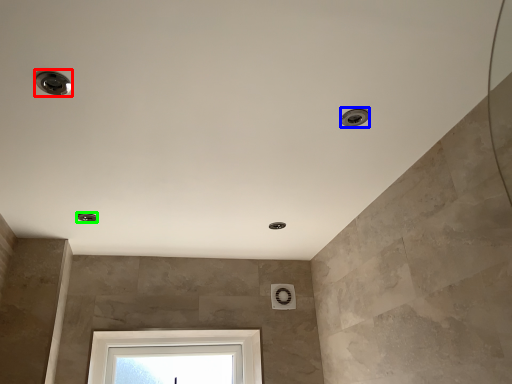
Question: Which object is the closest to the droplight (highlighted by a red box)? Choose among these: droplight (highlighted by a blue box) or droplight (highlighted by a green box).

Choices:
 (A) droplight
 (B) droplight

Answer: (A)